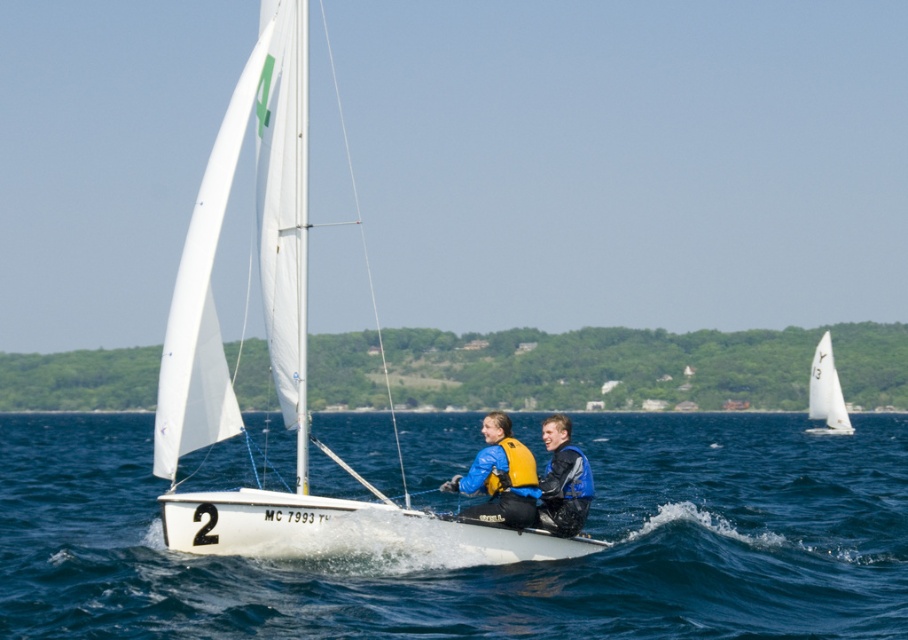
Does yellow life vest at center appear on the right side of blue leather jacket at center?

In fact, yellow life vest at center is to the left of blue leather jacket at center.

Who is higher up, yellow life vest at center or blue leather jacket at center?

Answer: Positioned higher is yellow life vest at center.

You are a GUI agent. You are given a task and a screenshot of the screen. Output one action in this format:
    pyautogui.click(x=<x>, y=<y>)
    Task: Click on the yellow life vest at center
    This screenshot has height=640, width=908.
    Given the screenshot: What is the action you would take?
    click(x=509, y=483)

Does blue leather jacket at center appear over white sail at upper right?

Yes, blue leather jacket at center is above white sail at upper right.

Does point (558, 420) come in front of point (825, 417)?

Yes.

Identify the location of blue leather jacket at center. (563, 481).

Which of these two, white water at center or yellow life vest at center, stands taller?

white water at center

Does point (245, 621) lie in front of point (459, 481)?

That is True.

This screenshot has height=640, width=908. Describe the element at coordinates (485, 564) in the screenshot. I see `white water at center` at that location.

Find the location of `white water at center`. white water at center is located at coordinates (485, 564).